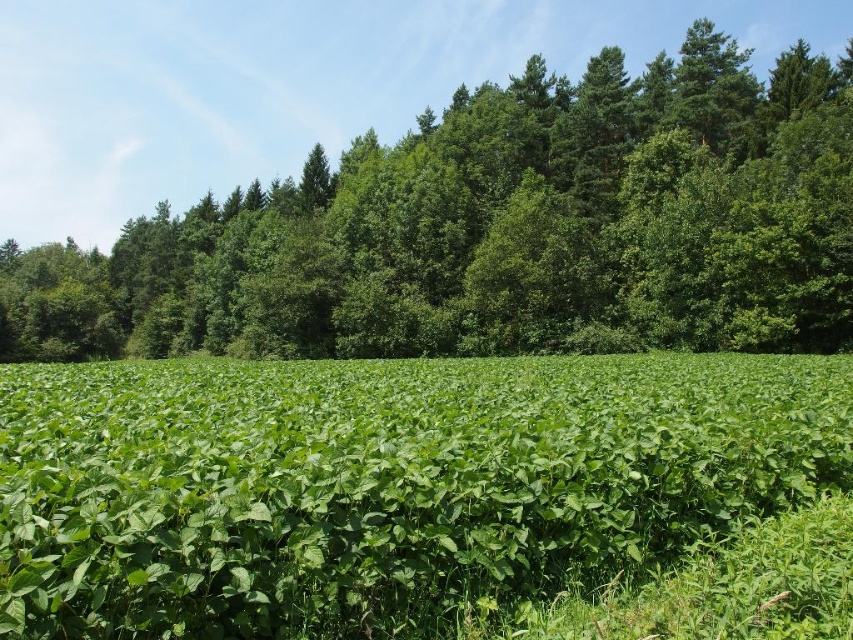
Based on the photo, you are standing at the origin point of the image coordinate system, which is the bottom left corner. You want to walk to the green leafy field at center. In which direction should you move relative to your current position?

Since the green leafy field at center is located at coordinate point (383, 484), you should move northeast to reach it from the origin point at the bottom left corner.